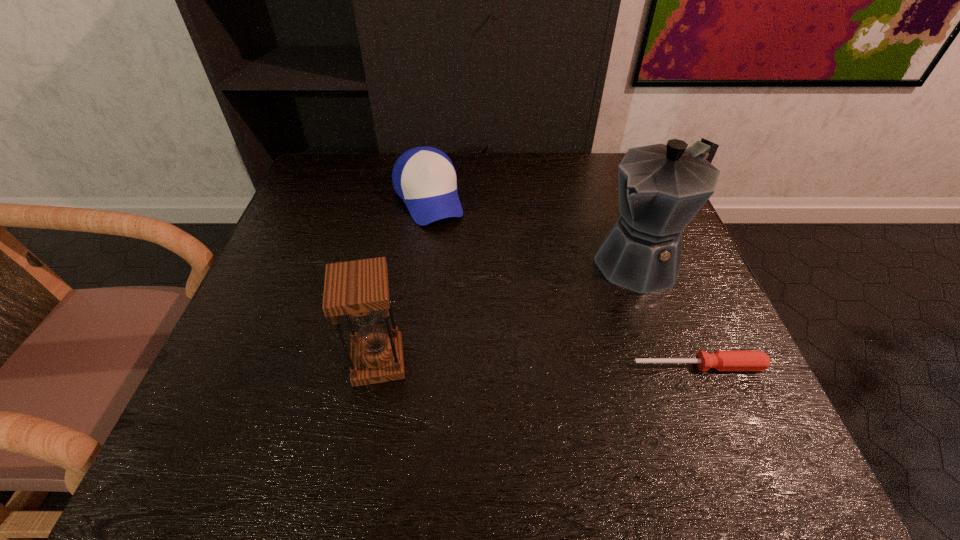
In the image, there is a desktop. What are the coordinates of `free space at the far left corner` in the screenshot? It's located at (352, 186).

At what (x,y) coordinates should I click in order to perform the action: click on blank space at the near left corner of the desktop. Please return your answer as a coordinate pair (x, y). The width and height of the screenshot is (960, 540). Looking at the image, I should click on (216, 407).

Locate an element on the screen. The width and height of the screenshot is (960, 540). vacant region at the far right corner of the desktop is located at coordinates (616, 176).

This screenshot has height=540, width=960. I want to click on free space that is in between the shortest object and the third nearest object, so click(x=671, y=314).

Identify the location of free space between the hourglass and the tallest object. (511, 311).

Where is `free space between the second tallest object and the coffeepot`? This screenshot has width=960, height=540. free space between the second tallest object and the coffeepot is located at coordinates (511, 311).

Where is `vacant region between the screwdriver and the baseball cap`? vacant region between the screwdriver and the baseball cap is located at coordinates point(564,282).

Where is `free space between the screwdriver and the hourglass`? free space between the screwdriver and the hourglass is located at coordinates (539, 364).

The image size is (960, 540). What are the coordinates of `vacant space in between the farthest object and the tallest object` in the screenshot? It's located at (536, 230).

At what (x,y) coordinates should I click in order to perform the action: click on vacant region between the hourglass and the tallest object. Please return your answer as a coordinate pair (x, y). The width and height of the screenshot is (960, 540). Looking at the image, I should click on (511, 311).